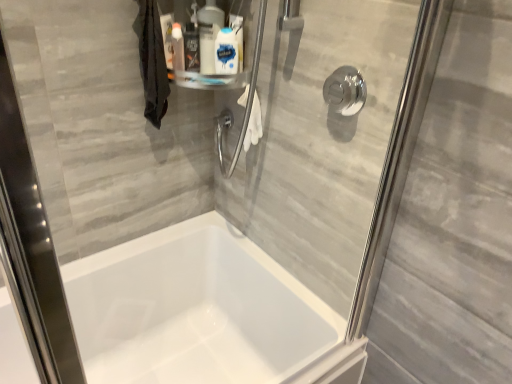
In order to face white glossy bottle at upper center, which is the 3th cleaning product in left-to-right order, should I rotate leftwards or rightwards?

You should rotate left by 4.001 degrees.

This screenshot has width=512, height=384. What do you see at coordinates (226, 52) in the screenshot?
I see `white glossy bottle at upper center, the 1th cleaning product from the right` at bounding box center [226, 52].

Consider the image. How much space does white glossy bottle at upper center, the second cleaning product from the right, occupy vertically?

The height of white glossy bottle at upper center, the second cleaning product from the right, is 9.11 inches.

The image size is (512, 384). I want to click on white glossy bottle at upper center, the second cleaning product from the right, so click(209, 34).

The width and height of the screenshot is (512, 384). What do you see at coordinates (345, 91) in the screenshot?
I see `polished chrome shower handle at upper right` at bounding box center [345, 91].

I want to click on translucent plastic spray bottle at upper center, which appears as the 3th cleaning product when viewed from the right, so click(191, 48).

The height and width of the screenshot is (384, 512). Identify the location of white glossy bottle at upper center, which is the 3th cleaning product in left-to-right order. (226, 52).

In terms of height, does polished chrome shower handle at upper right look taller or shorter compared to white glossy bottle at upper center, which ranks as the second cleaning product in left-to-right order?

Clearly, polished chrome shower handle at upper right is shorter compared to white glossy bottle at upper center, which ranks as the second cleaning product in left-to-right order.

Which of these two, polished chrome shower handle at upper right or white glossy bottle at upper center, the second cleaning product from the right, is thinner?

With smaller width is polished chrome shower handle at upper right.

What are the coordinates of `the 2nd cleaning product counting from the left side of the polished chrome shower handle at upper right` in the screenshot? It's located at (209, 34).

Are polished chrome shower handle at upper right and white glossy bottle at upper center, the second cleaning product from the right, making contact?

polished chrome shower handle at upper right and white glossy bottle at upper center, the second cleaning product from the right, are clearly separated.

Based on the photo, does white glossy bottle at upper center, which is the 3th cleaning product in left-to-right order, have a greater height compared to polished chrome shower handle at upper right?

Yes, white glossy bottle at upper center, which is the 3th cleaning product in left-to-right order, is taller than polished chrome shower handle at upper right.

Is white glossy bottle at upper center, the 1th cleaning product from the right, facing away from polished chrome shower handle at upper right?

No, white glossy bottle at upper center, the 1th cleaning product from the right,'s orientation is not away from polished chrome shower handle at upper right.

The width and height of the screenshot is (512, 384). There is a polished chrome shower handle at upper right. What are the coordinates of `the 2nd cleaning product above it (from the image's perspective)` in the screenshot? It's located at (191, 48).

From the image's perspective, would you say polished chrome shower handle at upper right is shown under translucent plastic spray bottle at upper center, which appears as the 3th cleaning product when viewed from the right?

Correct, polished chrome shower handle at upper right appears lower than translucent plastic spray bottle at upper center, which appears as the 3th cleaning product when viewed from the right, in the image.

Is point (352, 77) more distant than point (188, 46)?

No, it is in front of (188, 46).

Considering the sizes of objects white glossy bottle at upper center, which is the 3th cleaning product in left-to-right order, and translucent plastic spray bottle at upper center, which appears as the 3th cleaning product when viewed from the right, in the image provided, who is shorter, white glossy bottle at upper center, which is the 3th cleaning product in left-to-right order, or translucent plastic spray bottle at upper center, which appears as the 3th cleaning product when viewed from the right,?

translucent plastic spray bottle at upper center, which appears as the 3th cleaning product when viewed from the right, is shorter.

From the image's perspective, between white glossy bottle at upper center, which is the 3th cleaning product in left-to-right order, and translucent plastic spray bottle at upper center, which appears as the 3th cleaning product when viewed from the right, which one is located above?

translucent plastic spray bottle at upper center, which appears as the 3th cleaning product when viewed from the right, from the image's perspective.

Which is closer to the camera, (233, 46) or (198, 65)?

Point (233, 46) is closer to the camera than point (198, 65).

Which is correct: white glossy bottle at upper center, which ranks as the second cleaning product in left-to-right order, is inside polished chrome shower handle at upper right, or outside of it?

white glossy bottle at upper center, which ranks as the second cleaning product in left-to-right order, is not inside polished chrome shower handle at upper right, it's outside.

Based on the photo, does white glossy bottle at upper center, which ranks as the second cleaning product in left-to-right order, have a larger size compared to polished chrome shower handle at upper right?

Correct, white glossy bottle at upper center, which ranks as the second cleaning product in left-to-right order, is larger in size than polished chrome shower handle at upper right.

Looking at their sizes, would you say white glossy bottle at upper center, which ranks as the second cleaning product in left-to-right order, is wider or thinner than polished chrome shower handle at upper right?

Considering their sizes, white glossy bottle at upper center, which ranks as the second cleaning product in left-to-right order, looks broader than polished chrome shower handle at upper right.

Which of these two, white glossy bottle at upper center, which is the 3th cleaning product in left-to-right order, or white glossy bottle at upper center, the second cleaning product from the right, is bigger?

white glossy bottle at upper center, the second cleaning product from the right, is bigger.

Between white glossy bottle at upper center, which is the 3th cleaning product in left-to-right order, and white glossy bottle at upper center, which ranks as the second cleaning product in left-to-right order, which one has more height?

Standing taller between the two is white glossy bottle at upper center, which ranks as the second cleaning product in left-to-right order.

From the image's perspective, which object appears higher, white glossy bottle at upper center, the 1th cleaning product from the right, or white glossy bottle at upper center, the second cleaning product from the right?

white glossy bottle at upper center, the second cleaning product from the right.

Is white glossy bottle at upper center, the 1th cleaning product from the right, at the left side of white glossy bottle at upper center, which ranks as the second cleaning product in left-to-right order?

In fact, white glossy bottle at upper center, the 1th cleaning product from the right, is to the right of white glossy bottle at upper center, which ranks as the second cleaning product in left-to-right order.

Considering the sizes of objects translucent plastic spray bottle at upper center, which appears as the 3th cleaning product when viewed from the right, and white glossy bottle at upper center, which is the 3th cleaning product in left-to-right order, in the image provided, who is shorter, translucent plastic spray bottle at upper center, which appears as the 3th cleaning product when viewed from the right, or white glossy bottle at upper center, which is the 3th cleaning product in left-to-right order,?

Standing shorter between the two is translucent plastic spray bottle at upper center, which appears as the 3th cleaning product when viewed from the right.

Are translucent plastic spray bottle at upper center, marked as the 1th cleaning product in a left-to-right arrangement, and white glossy bottle at upper center, the 1th cleaning product from the right, far apart?

That's not correct — translucent plastic spray bottle at upper center, marked as the 1th cleaning product in a left-to-right arrangement, is a little close to white glossy bottle at upper center, the 1th cleaning product from the right.

From a real-world perspective, is translucent plastic spray bottle at upper center, marked as the 1th cleaning product in a left-to-right arrangement, on top of white glossy bottle at upper center, which is the 3th cleaning product in left-to-right order?

No, from a real-world perspective, translucent plastic spray bottle at upper center, marked as the 1th cleaning product in a left-to-right arrangement, is not over white glossy bottle at upper center, which is the 3th cleaning product in left-to-right order

From the image's perspective, which one is positioned higher, translucent plastic spray bottle at upper center, which appears as the 3th cleaning product when viewed from the right, or white glossy bottle at upper center, which is the 3th cleaning product in left-to-right order?

translucent plastic spray bottle at upper center, which appears as the 3th cleaning product when viewed from the right, appears higher in the image.

Where is `shower located on the right of white glossy bottle at upper center, which ranks as the second cleaning product in left-to-right order`? The height and width of the screenshot is (384, 512). shower located on the right of white glossy bottle at upper center, which ranks as the second cleaning product in left-to-right order is located at coordinates (345, 91).

I want to click on shower lying below the white glossy bottle at upper center, which is the 3th cleaning product in left-to-right order (from the image's perspective), so click(x=345, y=91).

Which object lies further to the anchor point white glossy bottle at upper center, the 1th cleaning product from the right, translucent plastic spray bottle at upper center, marked as the 1th cleaning product in a left-to-right arrangement, or white glossy bottle at upper center, which ranks as the second cleaning product in left-to-right order?

translucent plastic spray bottle at upper center, marked as the 1th cleaning product in a left-to-right arrangement, lies further to white glossy bottle at upper center, the 1th cleaning product from the right, than the other object.

When comparing their distances from polished chrome shower handle at upper right, does translucent plastic spray bottle at upper center, which appears as the 3th cleaning product when viewed from the right, or white glossy bottle at upper center, which is the 3th cleaning product in left-to-right order, seem closer?

The object closer to polished chrome shower handle at upper right is white glossy bottle at upper center, which is the 3th cleaning product in left-to-right order.

When comparing their distances from white glossy bottle at upper center, the second cleaning product from the right, does white glossy bottle at upper center, the 1th cleaning product from the right, or translucent plastic spray bottle at upper center, marked as the 1th cleaning product in a left-to-right arrangement, seem further?

translucent plastic spray bottle at upper center, marked as the 1th cleaning product in a left-to-right arrangement, is positioned further to the anchor white glossy bottle at upper center, the second cleaning product from the right.

Looking at the image, which one is located closer to white glossy bottle at upper center, the second cleaning product from the right, translucent plastic spray bottle at upper center, which appears as the 3th cleaning product when viewed from the right, or white glossy bottle at upper center, which is the 3th cleaning product in left-to-right order?

white glossy bottle at upper center, which is the 3th cleaning product in left-to-right order, lies closer to white glossy bottle at upper center, the second cleaning product from the right, than the other object.

Based on their spatial positions, is translucent plastic spray bottle at upper center, marked as the 1th cleaning product in a left-to-right arrangement, or white glossy bottle at upper center, which ranks as the second cleaning product in left-to-right order, further from polished chrome shower handle at upper right?

Based on the image, translucent plastic spray bottle at upper center, marked as the 1th cleaning product in a left-to-right arrangement, appears to be further to polished chrome shower handle at upper right.

Which object lies nearer to the anchor point polished chrome shower handle at upper right, white glossy bottle at upper center, the 1th cleaning product from the right, or white glossy bottle at upper center, which ranks as the second cleaning product in left-to-right order?

white glossy bottle at upper center, the 1th cleaning product from the right.

Which object lies nearer to the anchor point white glossy bottle at upper center, the second cleaning product from the right, polished chrome shower handle at upper right or white glossy bottle at upper center, the 1th cleaning product from the right?

white glossy bottle at upper center, the 1th cleaning product from the right.

Estimate the real-world distances between objects in this image. Which object is closer to white glossy bottle at upper center, which is the 3th cleaning product in left-to-right order, white glossy bottle at upper center, which ranks as the second cleaning product in left-to-right order, or translucent plastic spray bottle at upper center, which appears as the 3th cleaning product when viewed from the right?

The object closer to white glossy bottle at upper center, which is the 3th cleaning product in left-to-right order, is white glossy bottle at upper center, which ranks as the second cleaning product in left-to-right order.

Where is `cleaning product located between translucent plastic spray bottle at upper center, marked as the 1th cleaning product in a left-to-right arrangement, and white glossy bottle at upper center, which is the 3th cleaning product in left-to-right order, in the left-right direction`? This screenshot has width=512, height=384. cleaning product located between translucent plastic spray bottle at upper center, marked as the 1th cleaning product in a left-to-right arrangement, and white glossy bottle at upper center, which is the 3th cleaning product in left-to-right order, in the left-right direction is located at coordinates (209, 34).

Locate an element on the screen. The height and width of the screenshot is (384, 512). cleaning product between white glossy bottle at upper center, which ranks as the second cleaning product in left-to-right order, and polished chrome shower handle at upper right from left to right is located at coordinates (226, 52).